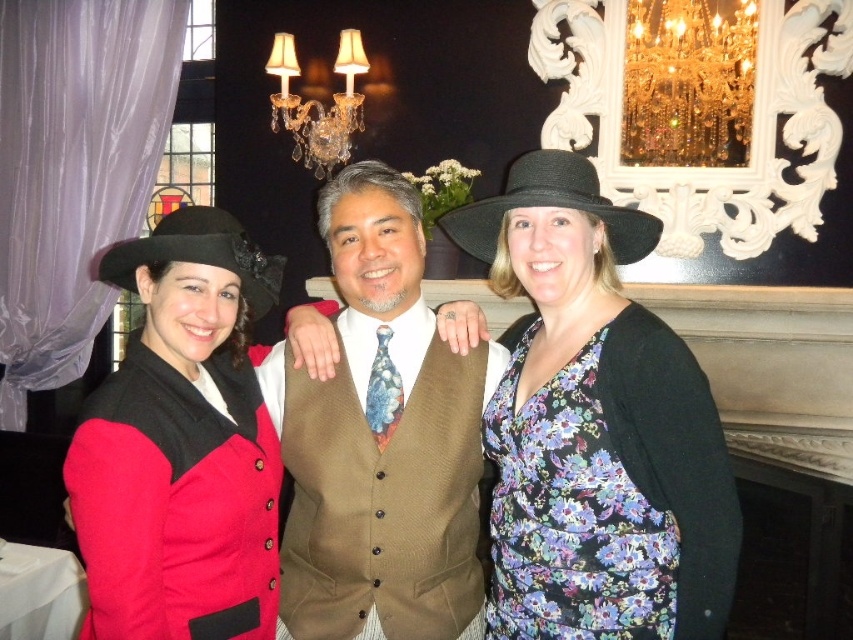
Question: Which object is positioned closest to the brown textured vest at center?

Choices:
 (A) matte black hat at left
 (B) crystal glass chandelier at upper center

Answer: (A)

Question: Is brown textured vest at center below crystal glass chandelier at upper center?

Choices:
 (A) yes
 (B) no

Answer: (A)

Question: Does floral fabric dress at center appear on the right side of black felt hat at center?

Choices:
 (A) yes
 (B) no

Answer: (A)

Question: Which object is positioned farthest from the gold crystal chandelier at upper center?

Choices:
 (A) brown textured vest at center
 (B) black felt hat at left
 (C) floral print fabric dress at center
 (D) floral fabric dress at center

Answer: (B)

Question: Among these points, which one is nearest to the camera?

Choices:
 (A) (698, 161)
 (B) (268, 56)
 (C) (303, 420)

Answer: (C)

Question: Does floral print fabric dress at center appear under black felt hat at center?

Choices:
 (A) no
 (B) yes

Answer: (B)